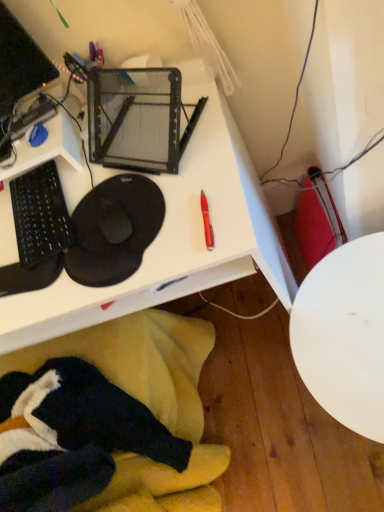
Question: Is white glossy table at lower right wider or thinner than white plastic desk at upper center?

Choices:
 (A) wide
 (B) thin

Answer: (B)

Question: From the image's perspective, relative to white plastic desk at upper center, is white glossy table at lower right above or below?

Choices:
 (A) below
 (B) above

Answer: (A)

Question: Which of these objects is positioned farthest from the velvet-like black swivel chair at lower left?

Choices:
 (A) black matte mouse pad at left
 (B) white plastic desk at upper center
 (C) white glossy table at lower right

Answer: (C)

Question: Estimate the real-world distances between objects in this image. Which object is farther from the white plastic desk at upper center?

Choices:
 (A) white glossy table at lower right
 (B) velvet-like black swivel chair at lower left
 (C) black matte mouse pad at left

Answer: (B)